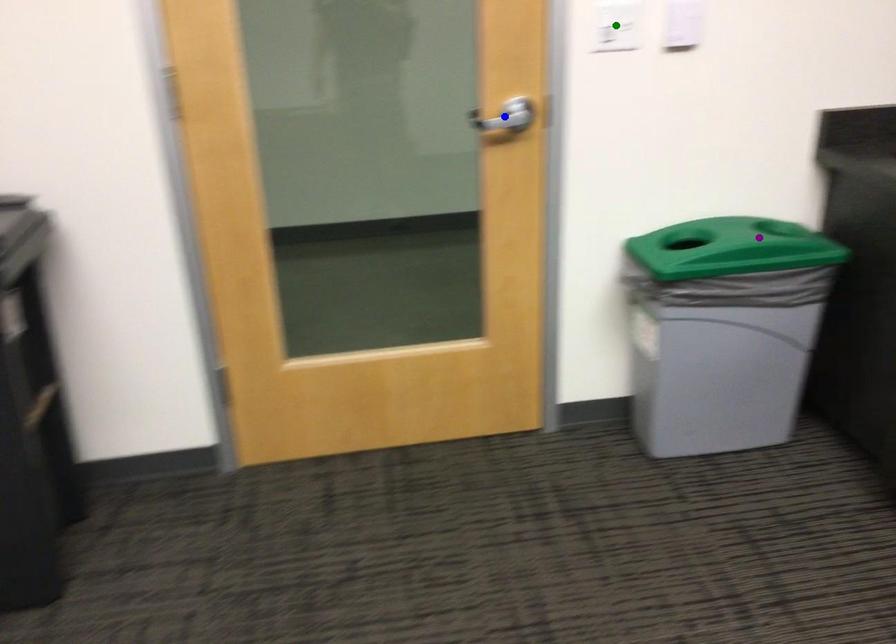
Order these from nearest to farthest:
1. blue point
2. purple point
3. green point

1. green point
2. blue point
3. purple point